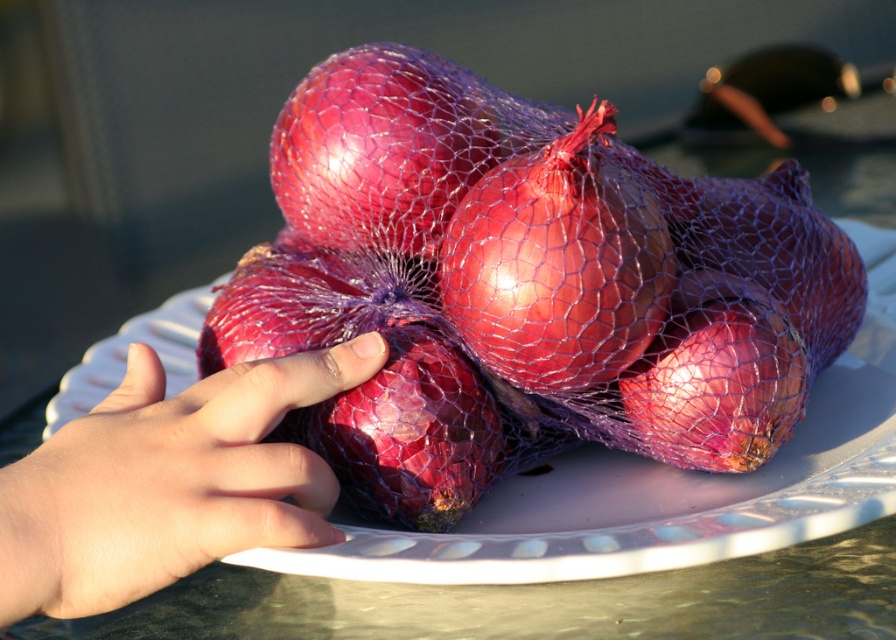
Question: Is smooth skin hand at center bigger than glossy purple onion at center?

Choices:
 (A) yes
 (B) no

Answer: (A)

Question: Which of these objects is positioned farthest from the smooth skin hand at center?

Choices:
 (A) glossy purple onion at center
 (B) glossy plastic onion at center
 (C) glossy mesh onion at center

Answer: (A)

Question: Considering the relative positions of purple mesh bag of onions at center and smooth skin hand at center in the image provided, where is purple mesh bag of onions at center located with respect to smooth skin hand at center?

Choices:
 (A) above
 (B) below

Answer: (A)

Question: Which object appears closest to the camera in this image?

Choices:
 (A) purple mesh bag of onions at center
 (B) glossy plastic onions at center
 (C) glossy mesh onion at center
 (D) glossy purple onion at center

Answer: (A)

Question: Which of the following is the closest to the observer?

Choices:
 (A) glossy mesh onion at center
 (B) smooth skin hand at center
 (C) glossy purple onion at center
 (D) glossy plastic onion at center

Answer: (B)

Question: Is glossy plastic onions at center wider than glossy mesh onion at center?

Choices:
 (A) no
 (B) yes

Answer: (B)